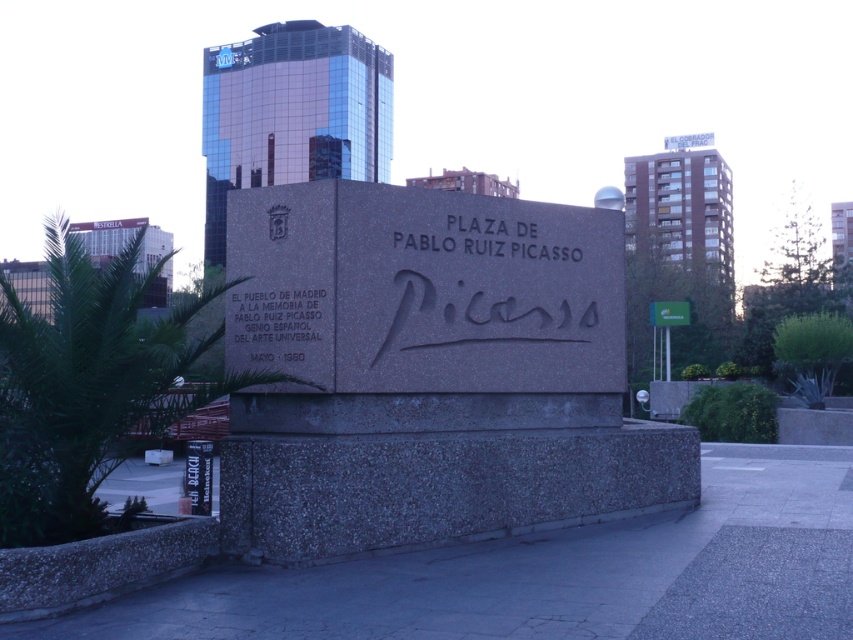
You are standing in Plaza de Pablo Ruiz Picasso and want to read the inscription on the gray granite sign at center. Can you read it clearly from where you are standing?

The gray granite sign at center is 7.91 meters away from the viewer. Since the average person can read a sign at that distance if the text is large enough, but the inscription size isn not specified. However, given the monument has prominent inscriptions, it is likely readable.

In the scene shown: You are a tourist standing in front of the monument. You notice the gray granite sign at center and the matte stone inscription at center. Which object is closer to you?

The gray granite sign at center is closer to you because it is in front of the matte stone inscription at center.